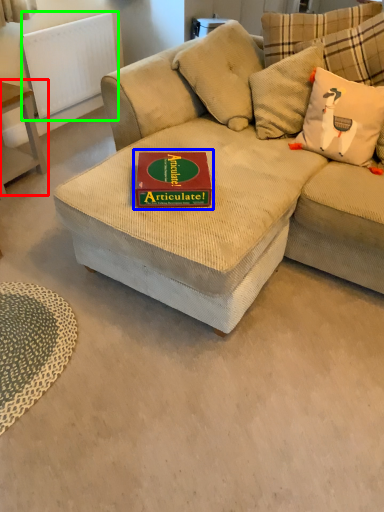
Question: Which object is the farthest from table (highlighted by a red box)? Choose among these: paperback book (highlighted by a blue box) or radiator (highlighted by a green box).

Choices:
 (A) paperback book
 (B) radiator

Answer: (A)